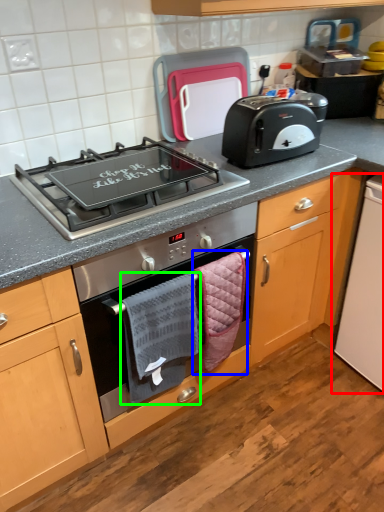
Question: Based on their relative distances, which object is farther from appliance (highlighted by a red box)? Choose from hand towel (highlighted by a blue box) and hand towel (highlighted by a green box).

Choices:
 (A) hand towel
 (B) hand towel

Answer: (B)